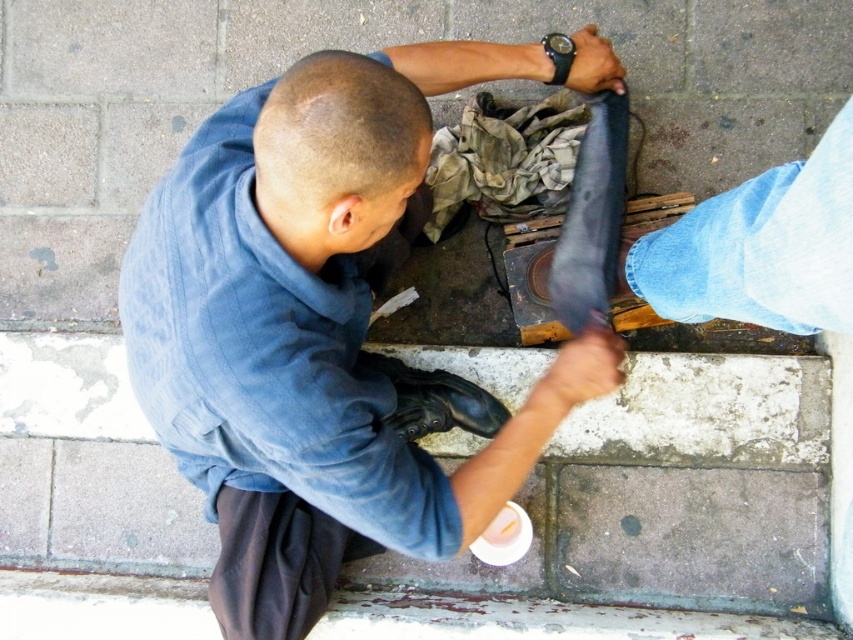
You are a pedestrian standing in front of the denim jacket at center and the black leather shoe at lower center. Which object is nearer to you?

The denim jacket at center is closer to the viewer than the black leather shoe at lower center.

You are a pedestrian walking on the sidewalk in the image. You notice a point at coordinates point (306, 326). What object is this point located on?

The point (306, 326) is located on the denim jacket at center.